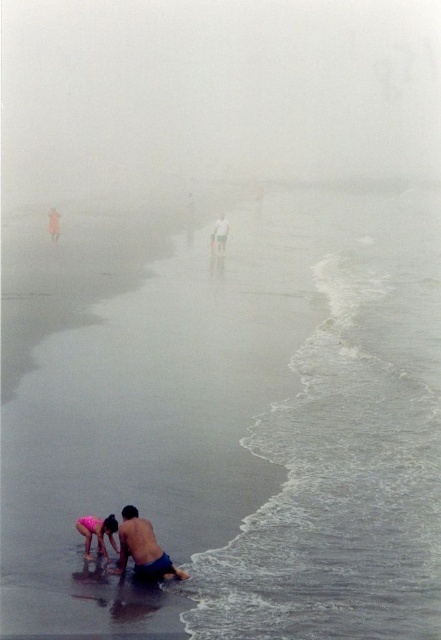
Question: Among these objects, which one is nearest to the camera?

Choices:
 (A) pink fabric at lower left
 (B) blue fabric shorts at lower center

Answer: (B)

Question: Does foggy white at upper center appear on the left side of pink fabric at lower left?

Choices:
 (A) yes
 (B) no

Answer: (A)

Question: Observing the image, what is the correct spatial positioning of foggy white at upper center in reference to blue fabric shorts at lower center?

Choices:
 (A) above
 (B) below

Answer: (A)

Question: Which of these objects is positioned farthest from the smooth white man at center?

Choices:
 (A) blue fabric shorts at lower center
 (B) foggy white at upper center
 (C) pink fabric at lower left

Answer: (B)

Question: Which point is closer to the camera taking this photo?

Choices:
 (A) (97, 518)
 (B) (221, 221)
 (C) (130, 506)

Answer: (A)

Question: Is blue fabric shorts at lower center further to camera compared to pink fabric at lower left?

Choices:
 (A) yes
 (B) no

Answer: (B)